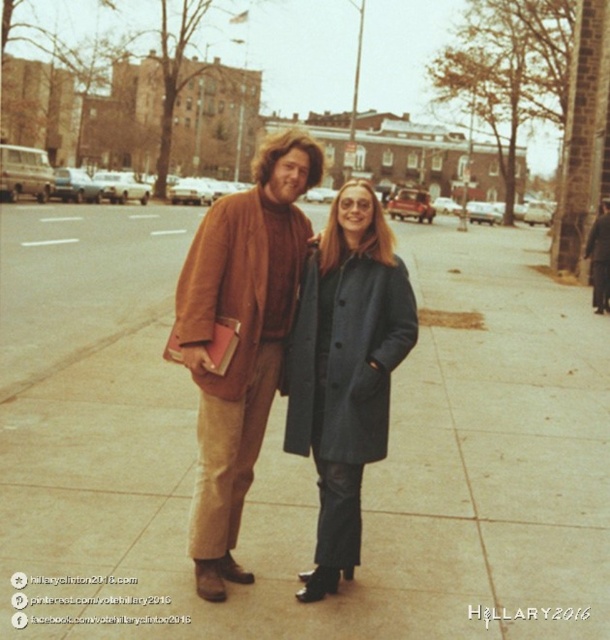
Which is below, slate gray concrete sidewalk at center or dark gray wool coat at center?

dark gray wool coat at center

Does point (529, 230) come behind point (320, 561)?

Yes, point (529, 230) is behind point (320, 561).

Is point (417, 618) positioned behind point (321, 429)?

No, (417, 618) is closer to viewer.

At what (x,y) coordinates should I click in order to perform the action: click on slate gray concrete sidewalk at center. Please return your answer as a coordinate pair (x, y). Looking at the image, I should click on (296, 456).

Can you confirm if matte brown jacket at center is positioned to the left of dark gray wool coat at center?

Yes, matte brown jacket at center is to the left of dark gray wool coat at center.

Can you confirm if matte brown jacket at center is thinner than dark gray wool coat at center?

No.

Is point (214, 227) positioned before point (378, 202)?

Yes, point (214, 227) is closer to viewer.

Locate an element on the screen. matte brown jacket at center is located at coordinates (240, 337).

Is slate gray concrete sidewalk at center to the left of matte brown jacket at center from the viewer's perspective?

Yes, slate gray concrete sidewalk at center is to the left of matte brown jacket at center.

Based on the photo, is slate gray concrete sidewalk at center to the right of matte brown jacket at center from the viewer's perspective?

In fact, slate gray concrete sidewalk at center is to the left of matte brown jacket at center.

Does point (514, 582) come closer to viewer compared to point (248, 452)?

That is False.

Image resolution: width=610 pixels, height=640 pixels. Find the location of `slate gray concrete sidewalk at center`. slate gray concrete sidewalk at center is located at coordinates (296, 456).